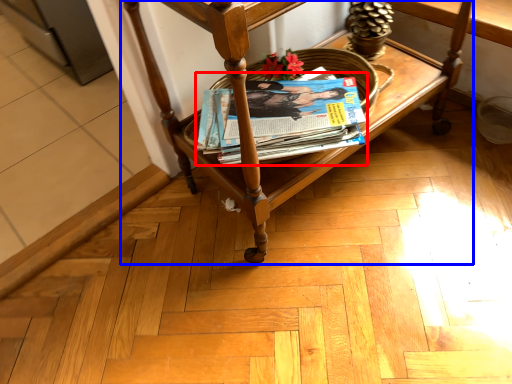
Question: Which point is closer to the camera, magazine (highlighted by a red box) or furniture (highlighted by a blue box)?

Choices:
 (A) magazine
 (B) furniture

Answer: (B)